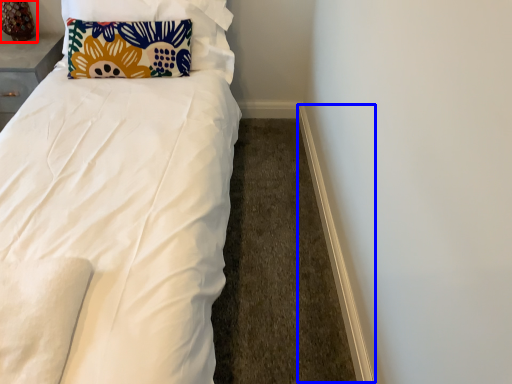
Question: Which of the following is the closest to the observer, table lamp (highlighted by a red box) or trim (highlighted by a blue box)?

Choices:
 (A) table lamp
 (B) trim

Answer: (B)